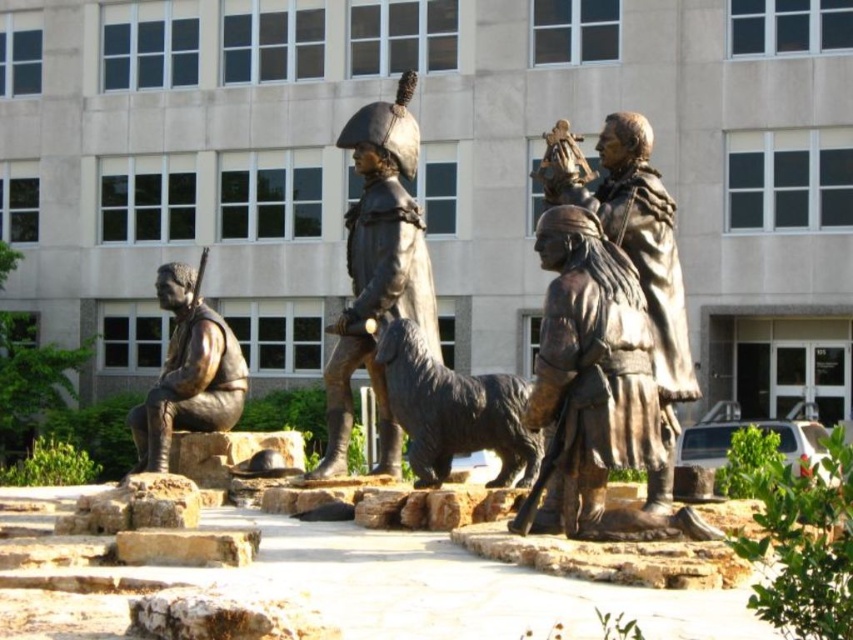
You are a tour guide explaining the sculpture group to visitors. You want to mention the spatial arrangement between the bronze statue at center and the bronze statue at left. How would you describe their positions?

The bronze statue at center is positioned on the right side of the bronze statue at left, meaning the statue at left is to the left of the central statue when viewed from the front.

You are standing in front of the modern building and want to take a photo of both the shiny bronze dog at center and the bronze statue at left. Which object should you focus on first to ensure both are in the frame?

You should focus on the bronze statue at left first because it is farther away from you than the shiny bronze dog at center, so adjusting the camera to include it will also capture the closer dog.

You are an art student analyzing the sculpture group. You need to determine which object is wider between the shiny bronze dog at center and the bronze statue at left. Based on the scene, which one is wider?

The shiny bronze dog at center is wider than the bronze statue at left according to the description.